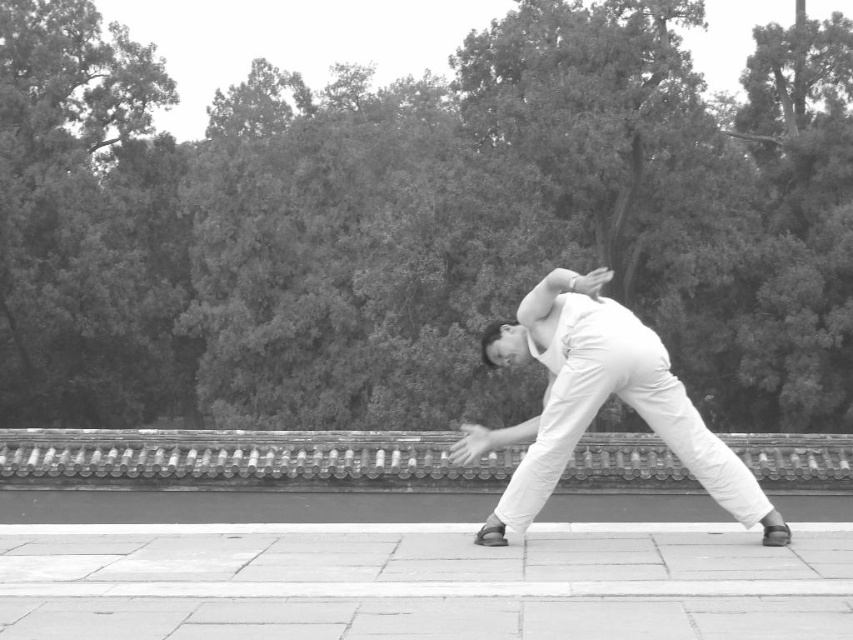
Question: Which point is farther to the camera?

Choices:
 (A) white cotton pants at center
 (B) smooth concrete pavement at lower center

Answer: (A)

Question: Does smooth concrete pavement at lower center appear on the right side of white cotton pants at center?

Choices:
 (A) yes
 (B) no

Answer: (A)

Question: Which point is closer to the camera taking this photo?

Choices:
 (A) (265, 589)
 (B) (639, 406)

Answer: (A)

Question: Among these points, which one is nearest to the camera?

Choices:
 (A) (341, 609)
 (B) (543, 292)

Answer: (A)

Question: Does smooth concrete pavement at lower center appear under white cotton pants at center?

Choices:
 (A) no
 (B) yes

Answer: (B)

Question: Is the position of smooth concrete pavement at lower center more distant than that of white cotton pants at center?

Choices:
 (A) no
 (B) yes

Answer: (A)